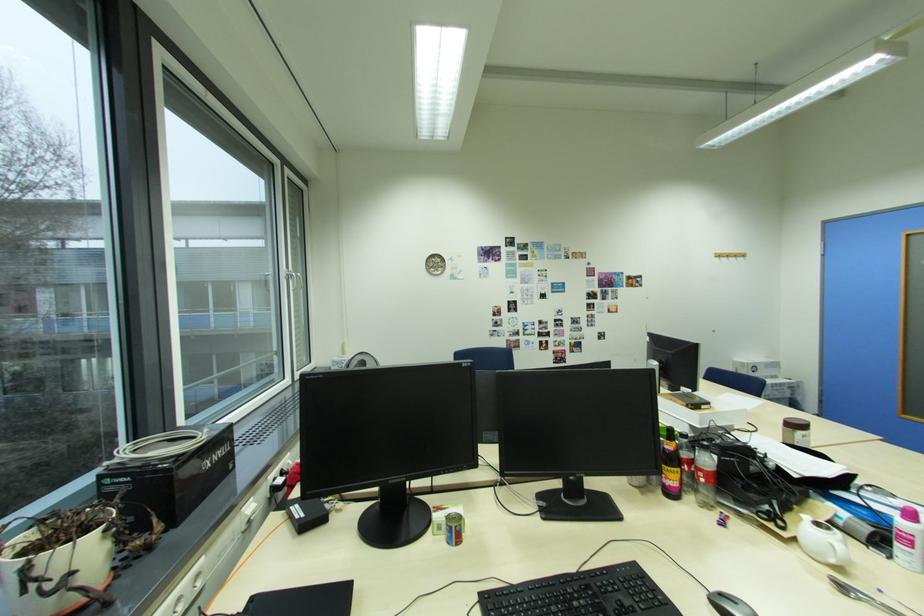
Where would you lift the metal spoon? Please return your answer as a coordinate pair (x, y).

(860, 594)